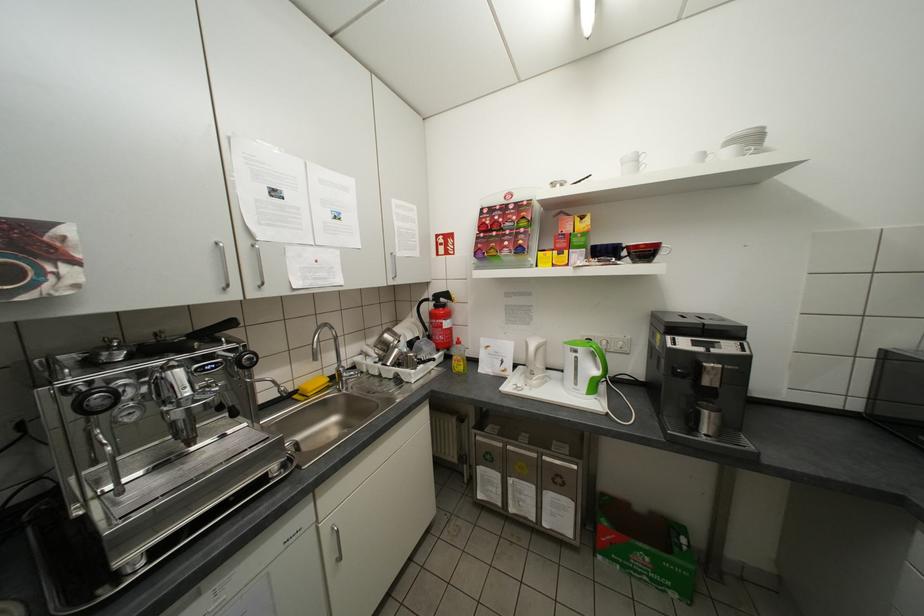
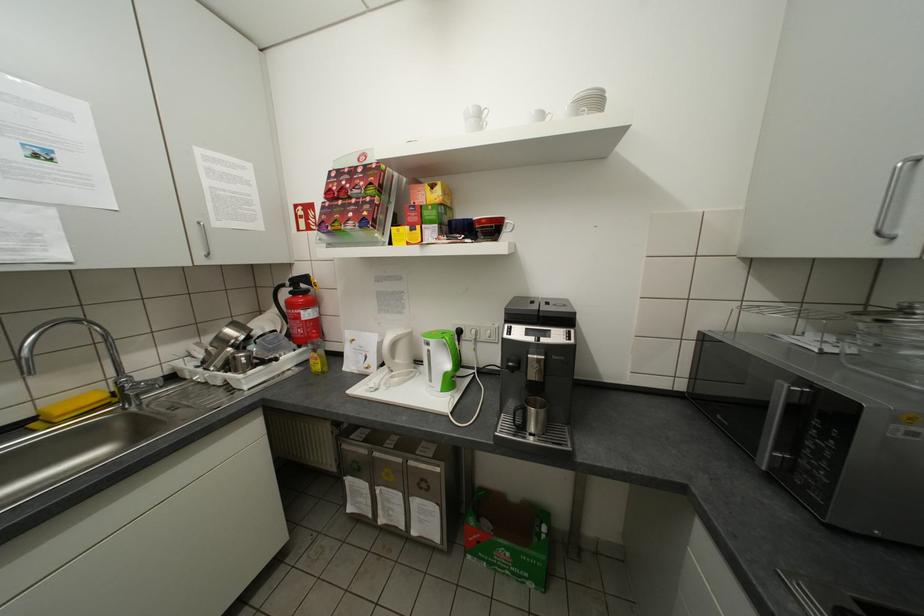
Locate, in the second image, the point that corresponds to pixel 453 322 in the first image.

(310, 312)